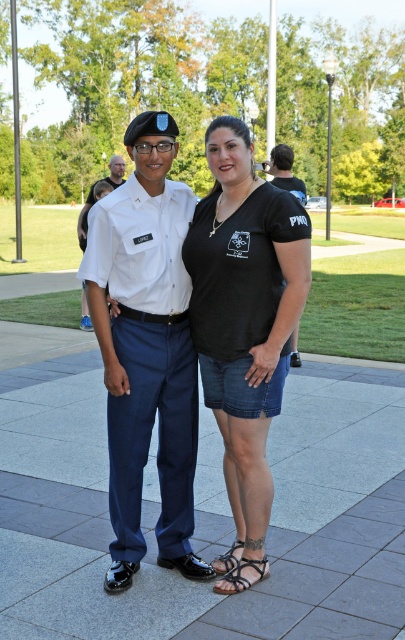
You are a photographer standing in front of the two people in the image. You want to capture a closeup of the brown leather sandal at lower center without including the black leather sandal at lower center in the frame. Is this possible given their positions?

The black leather sandal at lower center is positioned under the brown leather sandal at lower center, so it might be challenging to capture the brown one without including the black one in the frame.

You are standing in the park and want to walk towards the two points marked in the image. Which point, point (274, 280) or point (142, 484), will you reach first?

Point (274, 280) is closer to the viewer than point (142, 484), so you will reach point (274, 280) first.

You are standing at the origin point of the image coordinate system. You see a point at coordinate (243, 576). What object is located at that point?

The point at coordinate (243, 576) corresponds to the black leather sandal at lower center.